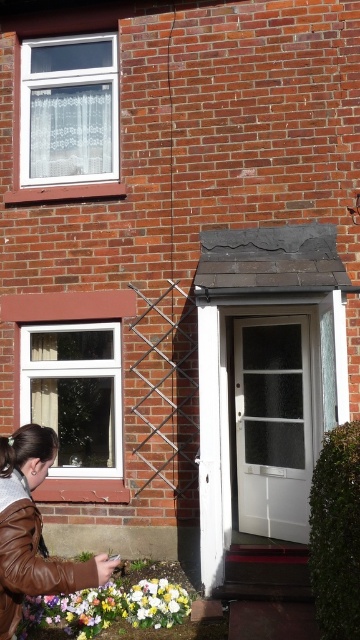
Question: Does brown leather jacket at lower left have a larger size compared to glossy floral bouquet at lower center?

Choices:
 (A) yes
 (B) no

Answer: (B)

Question: Can you confirm if brown leather jacket at lower left is positioned to the right of glossy floral bouquet at lower center?

Choices:
 (A) yes
 (B) no

Answer: (B)

Question: Among these points, which one is nearest to the camera?

Choices:
 (A) (154, 611)
 (B) (47, 433)

Answer: (B)

Question: Which point is closer to the camera?

Choices:
 (A) glossy floral bouquet at lower center
 (B) brown leather jacket at lower left

Answer: (B)

Question: Can you confirm if brown leather jacket at lower left is smaller than glossy floral bouquet at lower center?

Choices:
 (A) no
 (B) yes

Answer: (B)